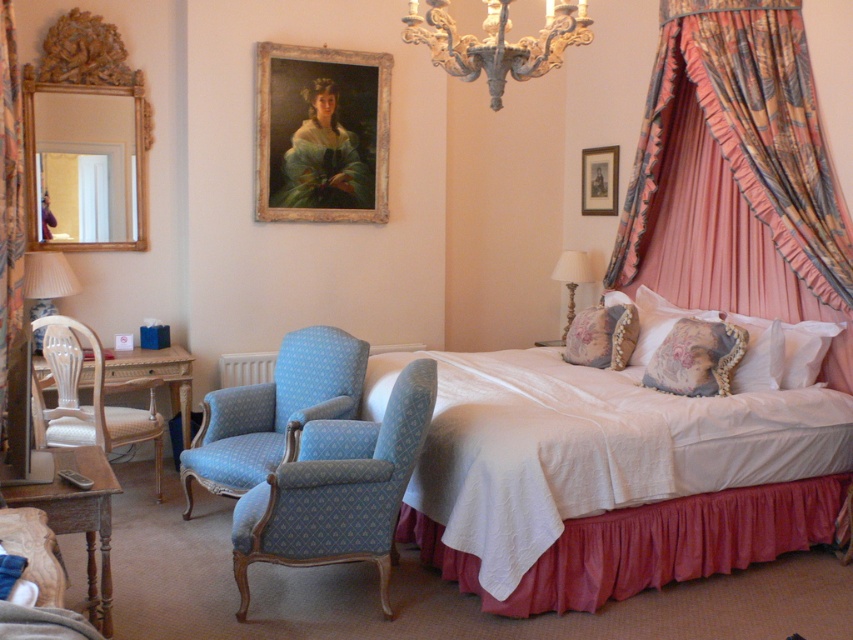
Question: Is the position of pink damask curtain at right less distant than that of antique brass chandelier at upper center?

Choices:
 (A) yes
 (B) no

Answer: (B)

Question: Which of these objects is positioned farthest from the metallic silver picture frame at upper right?

Choices:
 (A) woven cane chair at left
 (B) white quilted fabric bed at center

Answer: (A)

Question: Which of the following is the closest to the observer?

Choices:
 (A) (32, 376)
 (B) (401, 371)
 (C) (817, 211)
 (D) (376, 209)

Answer: (B)

Question: Is gold-toned wood picture frame at upper center wider than metallic silver picture frame at upper right?

Choices:
 (A) no
 (B) yes

Answer: (B)

Question: Can you confirm if velvet floral curtain at left is positioned above wooden table at lower left?

Choices:
 (A) no
 (B) yes

Answer: (B)

Question: Which of the following is the closest to the observer?

Choices:
 (A) floral fabric pillow at bed
 (B) pink damask curtain at right
 (C) white quilted fabric bed at center
 (D) wooden table at lower left

Answer: (D)